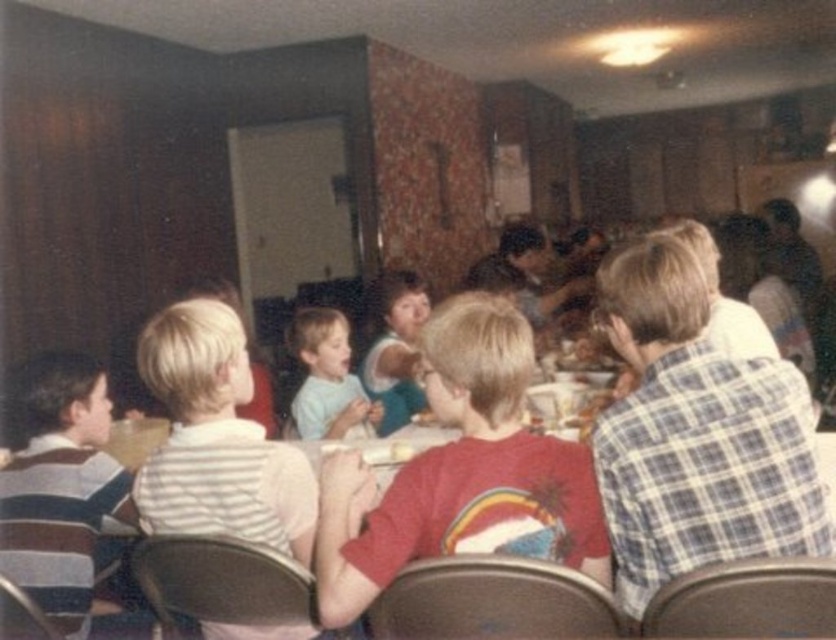
You are standing at the entrance of the dining area and see a point marked at coordinates (461, 472). Which object is this point located on?

The point at coordinates (461, 472) is located on the red plaid shirt at center.

You are a photographer trying to capture a group photo of the children sitting around the long table. Since you want to ensure that both the red plaid shirt at center and the light blue shirt at center are clearly visible, which shirt should you focus on to make sure it doesn

The red plaid shirt at center is bigger than the light blue shirt at center, so focusing on the red plaid shirt at center will ensure it is clearly visible, and the light blue shirt at center will also be in focus due to its proximity.

You are a photographer trying to capture a group photo of the children sitting around the table. You notice the red plaid shirt at center and the light blue shirt at center. Which shirt should you focus on to ensure the entire group is visible in the frame without cropping any part of the shirts?

You should focus on the light blue shirt at center because it is narrower than the red plaid shirt at center, which is wider. By centering the light blue shirt, you can adjust the frame to include the wider red plaid shirt without cropping.